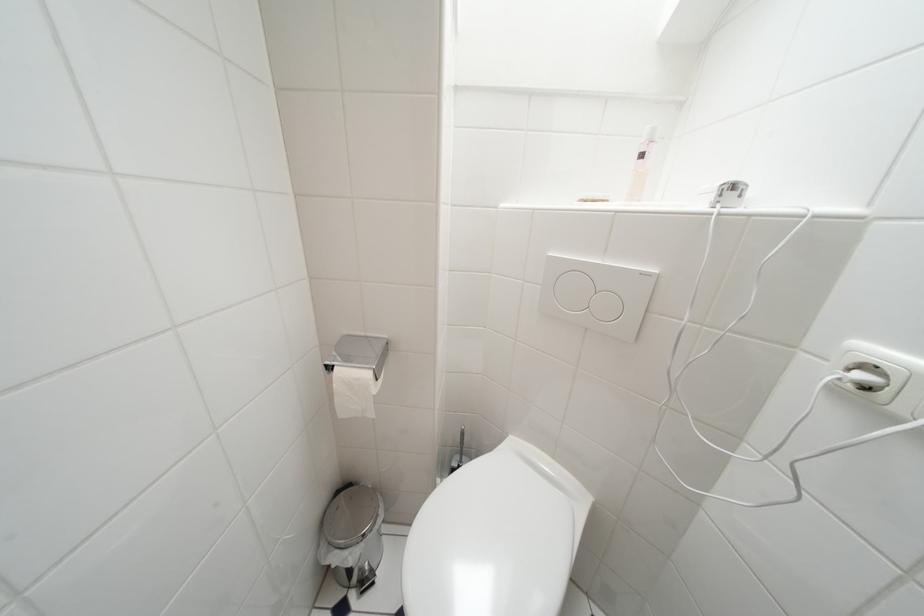
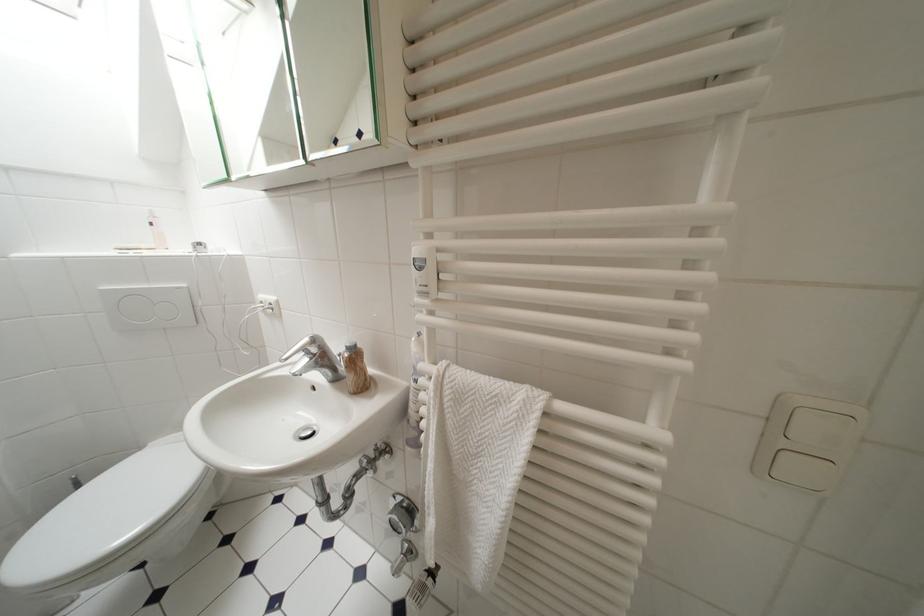
In the second image, find the point that corresponds to point (649, 277) in the first image.

(185, 291)